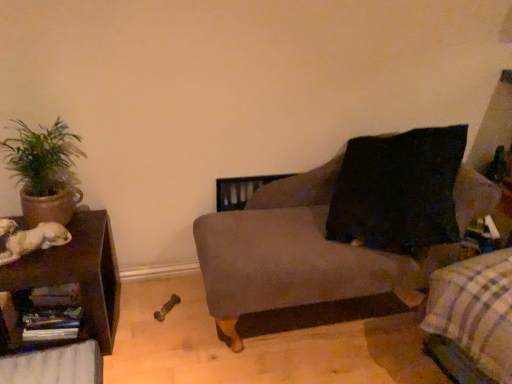
This screenshot has height=384, width=512. In order to click on free space that is in between brown wood table at left and velvet gray couch at center in this screenshot , I will do `click(157, 323)`.